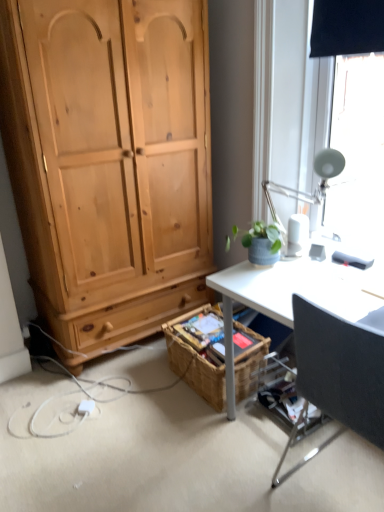
Question: Considering the relative sizes of black fabric chair at right and woven brown picnic basket at lower center in the image provided, is black fabric chair at right smaller than woven brown picnic basket at lower center?

Choices:
 (A) yes
 (B) no

Answer: (B)

Question: From a real-world perspective, is black fabric chair at right positioned over woven brown picnic basket at lower center based on gravity?

Choices:
 (A) no
 (B) yes

Answer: (B)

Question: Is black fabric chair at right thinner than woven brown picnic basket at lower center?

Choices:
 (A) yes
 (B) no

Answer: (B)

Question: Is black fabric chair at right bigger than woven brown picnic basket at lower center?

Choices:
 (A) no
 (B) yes

Answer: (B)

Question: Is black fabric chair at right wider than woven brown picnic basket at lower center?

Choices:
 (A) no
 (B) yes

Answer: (B)

Question: From their relative heights in the image, would you say white plastic power outlet at lower left is taller or shorter than black fabric chair at right?

Choices:
 (A) tall
 (B) short

Answer: (B)

Question: Is white plastic power outlet at lower left spatially inside black fabric chair at right, or outside of it?

Choices:
 (A) outside
 (B) inside

Answer: (A)

Question: From a real-world perspective, is white plastic power outlet at lower left above or below black fabric chair at right?

Choices:
 (A) below
 (B) above

Answer: (A)

Question: Looking at their shapes, would you say white plastic power outlet at lower left is wider or thinner than black fabric chair at right?

Choices:
 (A) thin
 (B) wide

Answer: (A)

Question: From the image's perspective, is white metallic lamp at upper right above or below white plastic power outlet at lower left?

Choices:
 (A) below
 (B) above

Answer: (B)

Question: Considering the positions of white metallic lamp at upper right and white plastic power outlet at lower left in the image, is white metallic lamp at upper right wider or thinner than white plastic power outlet at lower left?

Choices:
 (A) thin
 (B) wide

Answer: (B)

Question: Is point (284, 233) positioned closer to the camera than point (77, 410)?

Choices:
 (A) closer
 (B) farther

Answer: (A)

Question: From their relative heights in the image, would you say white metallic lamp at upper right is taller or shorter than white plastic power outlet at lower left?

Choices:
 (A) tall
 (B) short

Answer: (A)

Question: Considering the positions of woven brown picnic basket at lower center and white metallic lamp at upper right in the image, is woven brown picnic basket at lower center taller or shorter than white metallic lamp at upper right?

Choices:
 (A) short
 (B) tall

Answer: (A)

Question: From the image's perspective, is woven brown picnic basket at lower center located above or below white metallic lamp at upper right?

Choices:
 (A) below
 (B) above

Answer: (A)